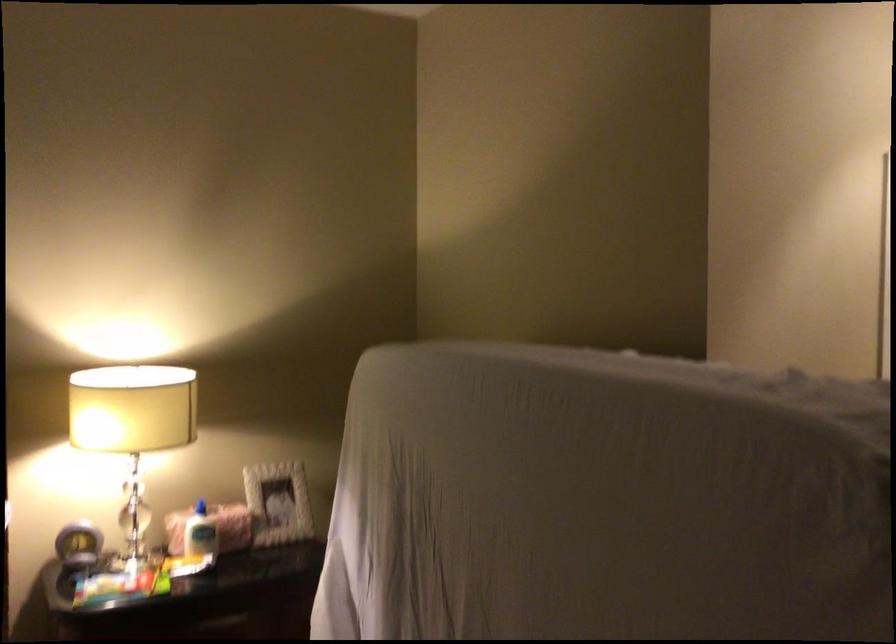
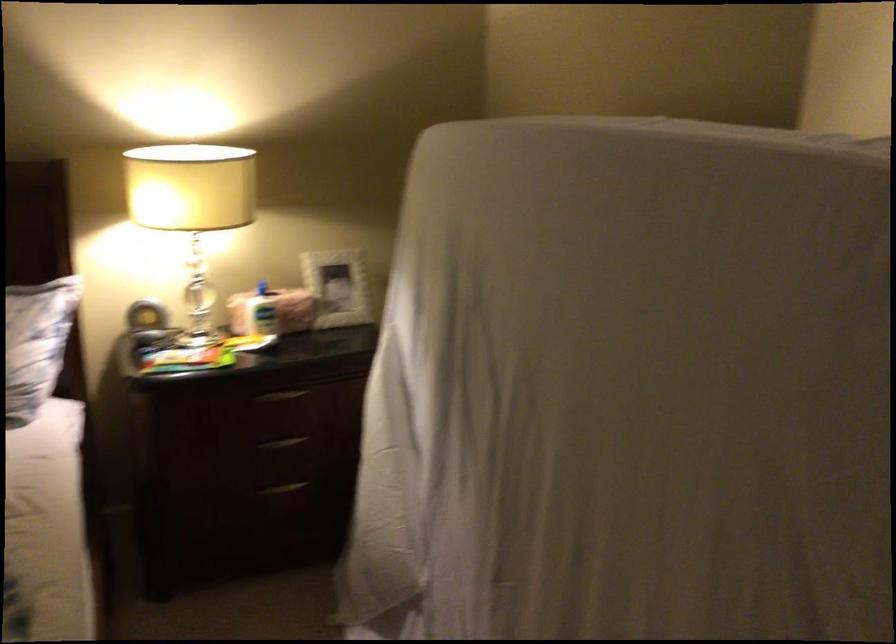
Locate, in the second image, the point that corresponds to (x=277, y=500) in the first image.

(337, 287)